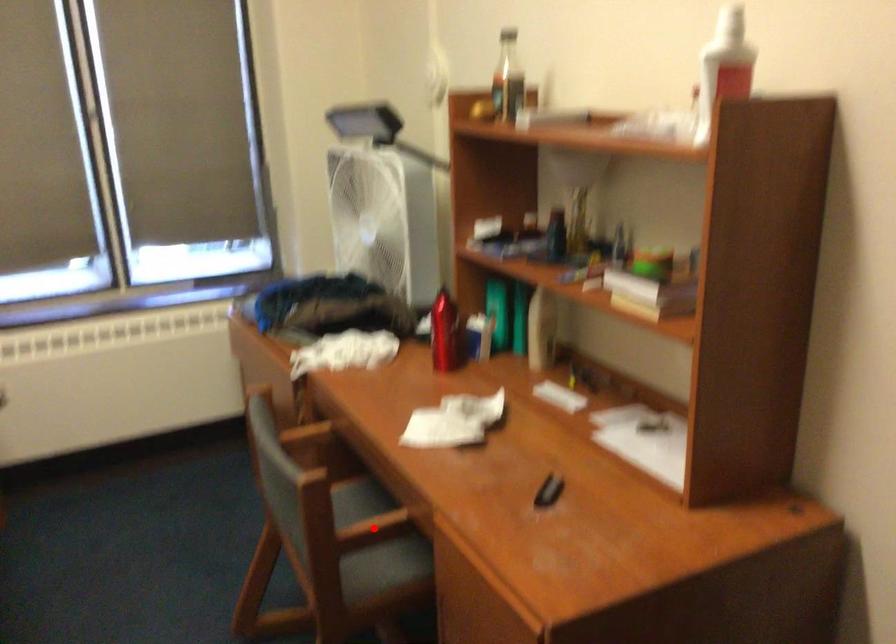
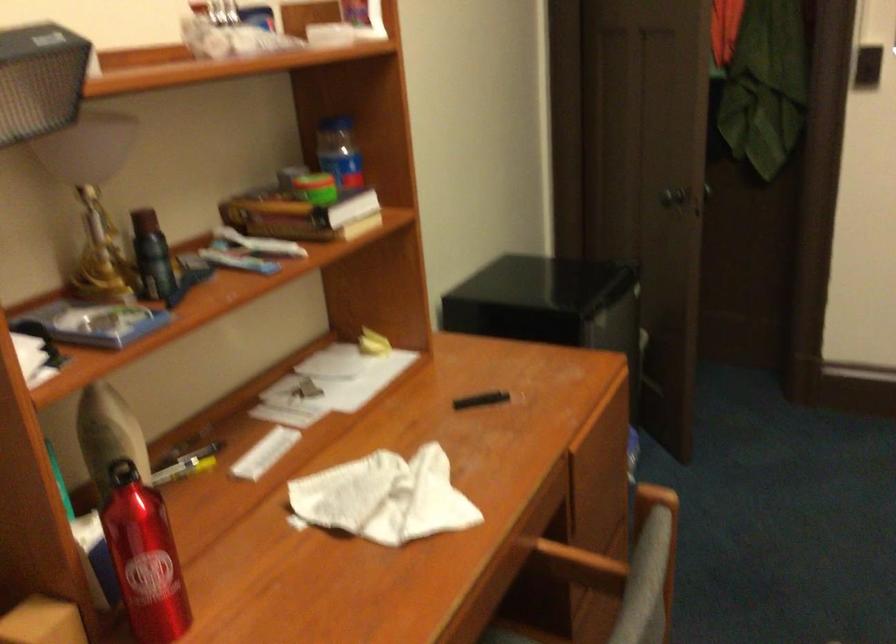
Locate, in the second image, the point that corresponds to the highlighted location in the first image.

(579, 565)